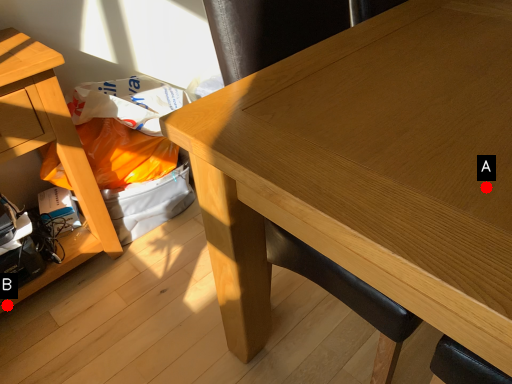
Question: Two points are circled on the image, labeled by A and B beside each circle. Which of the following is the closest to the observer?

Choices:
 (A) A is closer
 (B) B is closer

Answer: (A)